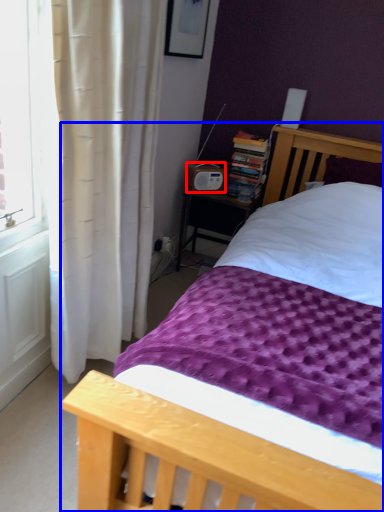
Question: Among these objects, which one is farthest to the camera, radio (highlighted by a red box) or bed (highlighted by a blue box)?

Choices:
 (A) radio
 (B) bed

Answer: (A)